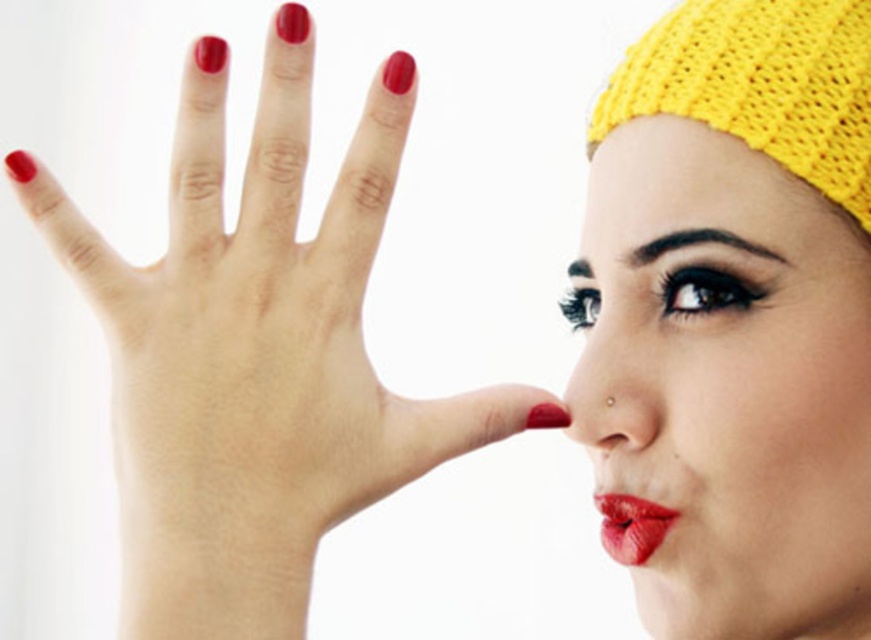
Does point (611, 412) come behind point (653, 531)?

No.

Describe the element at coordinates (615, 384) in the screenshot. I see `matte gold nose at center` at that location.

Image resolution: width=871 pixels, height=640 pixels. Identify the location of matte gold nose at center. (x=615, y=384).

Who is more forward, (844, 81) or (646, 557)?

Positioned in front is point (844, 81).

Does point (815, 152) come farther from viewer compared to point (598, 499)?

No.

Identify the location of knitted yellow hat at upper right. This screenshot has width=871, height=640. (760, 84).

Between point (714, 420) and point (287, 321), which one is positioned in front?

Point (287, 321) is in front.

This screenshot has height=640, width=871. I want to click on yellow knitted headband at upper right, so click(x=727, y=381).